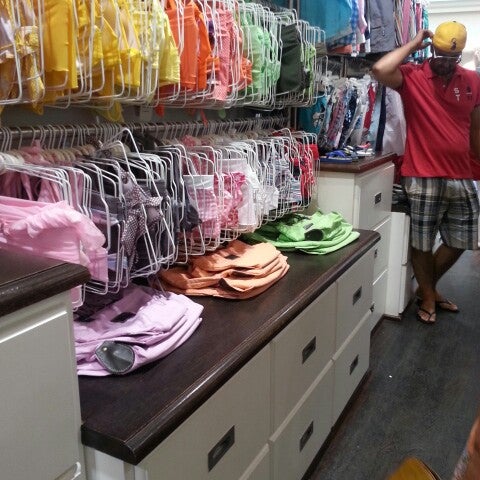
Locate an element on the screen. handle is located at coordinates (314, 441), (360, 366), (366, 300), (310, 350), (221, 447), (377, 192), (377, 260), (378, 304).